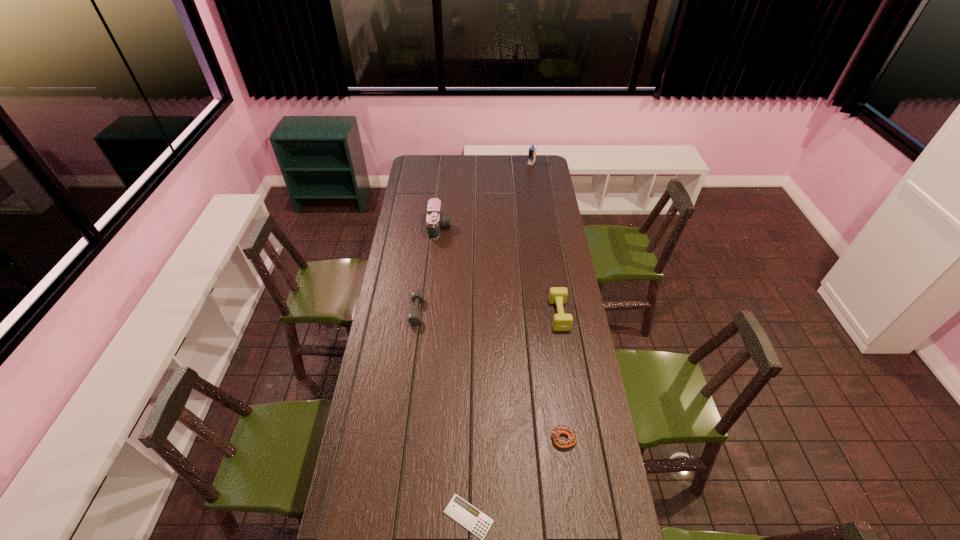
Locate an element on the screen. the closest object to the taller dumbbell is located at coordinates (557, 430).

Identify which object is the fifth closest to the camera. Please provide its 2D coordinates. Your answer should be formatted as a tuple, i.e. [(x, y)], where the tuple contains the x and y coordinates of a point satisfying the conditions above.

[(478, 523)]

Where is `free space that satisfies the following two spatial constraints: 1. on the front-facing side of the second farthest object; 2. on the left side of the second nearest object`? free space that satisfies the following two spatial constraints: 1. on the front-facing side of the second farthest object; 2. on the left side of the second nearest object is located at coordinates (420, 438).

The height and width of the screenshot is (540, 960). I want to click on vacant space that satisfies the following two spatial constraints: 1. on the front-facing side of the taller dumbbell; 2. on the right side of the camera, so click(x=431, y=315).

The width and height of the screenshot is (960, 540). In order to click on free point that satisfies the following two spatial constraints: 1. on the front side of the third tallest object; 2. on the left side of the orange_juice in this screenshot , I will do `click(554, 315)`.

Locate an element on the screen. The height and width of the screenshot is (540, 960). blank area in the image that satisfies the following two spatial constraints: 1. on the front-facing side of the taller dumbbell; 2. on the right side of the camera is located at coordinates (431, 315).

I want to click on free location that satisfies the following two spatial constraints: 1. on the front side of the farthest object; 2. on the front-facing side of the camera, so click(541, 227).